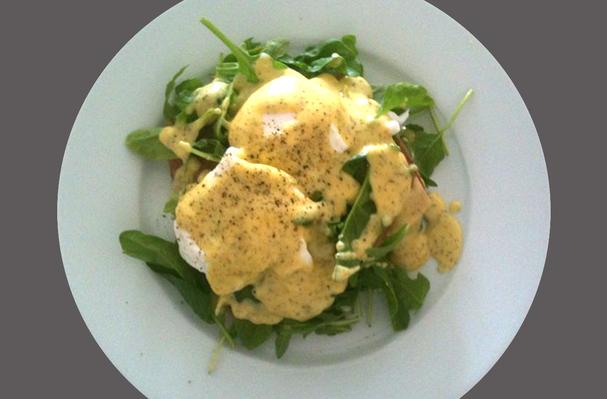
Find the location of a particular element. This screenshot has height=399, width=607. edge of food section of plate is located at coordinates (155, 281), (140, 218), (368, 357), (432, 303), (470, 205).